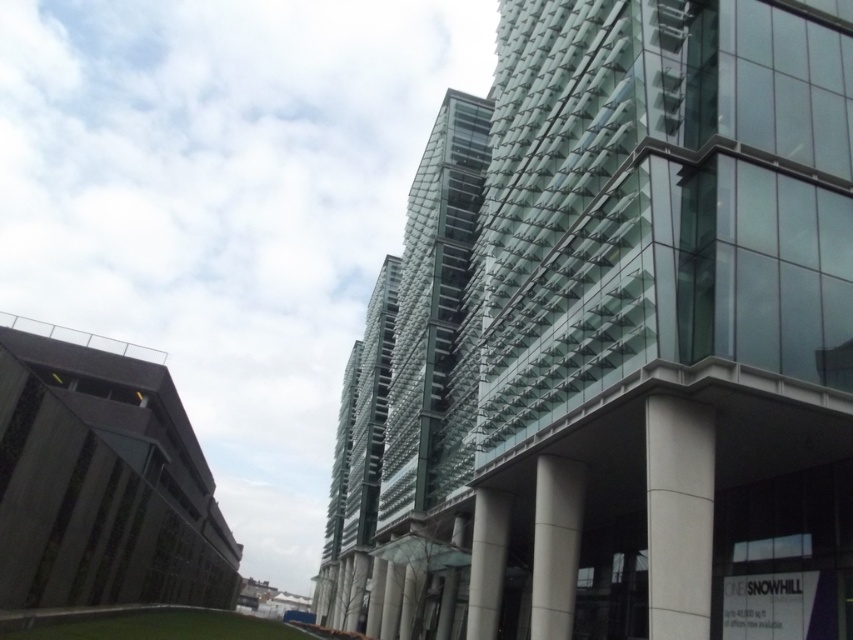
Question: Which of the following is the closest to the observer?

Choices:
 (A) white smooth pillar at center
 (B) transparent glass building at center
 (C) white concrete pillar at lower right
 (D) white glossy pillar at center

Answer: (C)

Question: Is transparent glass building at center thinner than white concrete pillar at lower right?

Choices:
 (A) yes
 (B) no

Answer: (B)

Question: Which of the following is the closest to the observer?

Choices:
 (A) white smooth pillar at center
 (B) white glossy pillar at center

Answer: (A)

Question: Which is farther from the white glossy pillar at center?

Choices:
 (A) transparent glass building at center
 (B) white concrete pillar at lower right

Answer: (A)

Question: Is white concrete pillar at lower right closer to the viewer compared to white smooth pillar at center?

Choices:
 (A) no
 (B) yes

Answer: (B)

Question: Is transparent glass building at center to the left of white concrete pillar at lower right from the viewer's perspective?

Choices:
 (A) yes
 (B) no

Answer: (A)